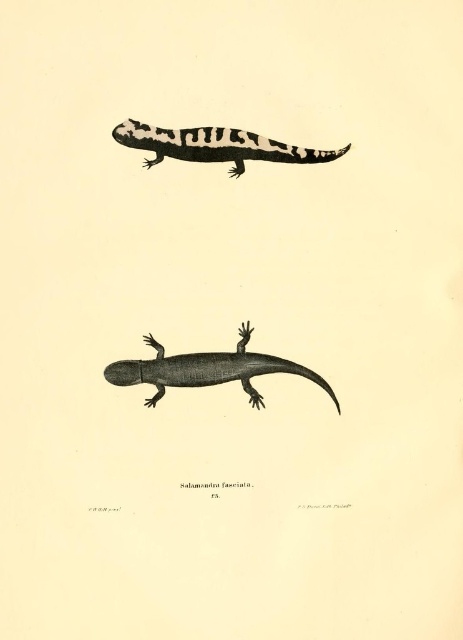
Question: Which object is closer to the camera taking this photo?

Choices:
 (A) black and white striped salamander at upper center
 (B) gray textured salamander at center

Answer: (A)

Question: Does gray textured salamander at center have a larger size compared to black and white striped salamander at upper center?

Choices:
 (A) yes
 (B) no

Answer: (A)

Question: Does gray textured salamander at center have a lesser width compared to black and white striped salamander at upper center?

Choices:
 (A) yes
 (B) no

Answer: (B)

Question: From the image, what is the correct spatial relationship of gray textured salamander at center in relation to black and white striped salamander at upper center?

Choices:
 (A) right
 (B) left

Answer: (B)

Question: Which of the following is the closest to the observer?

Choices:
 (A) (193, 156)
 (B) (257, 362)

Answer: (A)